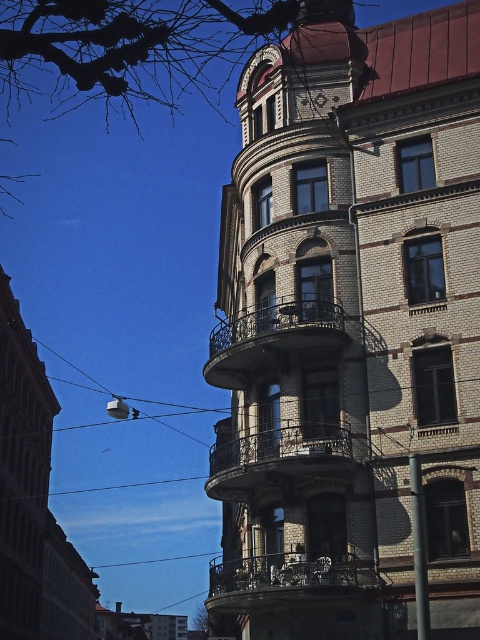
The height and width of the screenshot is (640, 480). What do you see at coordinates (278, 460) in the screenshot?
I see `dark brown wrought iron balcony at center` at bounding box center [278, 460].

Can you confirm if dark brown wrought iron balcony at center is thinner than metallic wrought iron balcony at center?

Indeed, dark brown wrought iron balcony at center has a lesser width compared to metallic wrought iron balcony at center.

The height and width of the screenshot is (640, 480). What do you see at coordinates (278, 460) in the screenshot? I see `dark brown wrought iron balcony at center` at bounding box center [278, 460].

Identify the location of dark brown wrought iron balcony at center. (278, 460).

Is point (304, 476) less distant than point (321, 92)?

Yes, point (304, 476) is closer to viewer.

Who is shorter, dark brown wrought iron balcony at center or white ceramic clock at upper center?

Standing shorter between the two is white ceramic clock at upper center.

Between point (288, 472) and point (323, 96), which one is positioned behind?

The point (323, 96) is more distant.

Locate an element on the screen. This screenshot has height=640, width=480. dark brown wrought iron balcony at center is located at coordinates (278, 460).

From the picture: Who is shorter, metallic wrought iron balcony at center or white ceramic clock at upper center?

Standing shorter between the two is white ceramic clock at upper center.

Between metallic wrought iron balcony at center and white ceramic clock at upper center, which one appears on the right side from the viewer's perspective?

white ceramic clock at upper center

Which is behind, point (266, 560) or point (321, 104)?

The point (321, 104) is more distant.

Find the location of a particular element. metallic wrought iron balcony at center is located at coordinates [x=285, y=580].